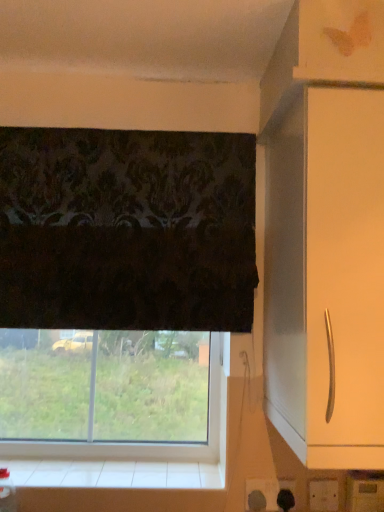
What are the coordinates of `vacant area on top of white tile at lower center (from a real-world perspective)` in the screenshot? It's located at (107, 471).